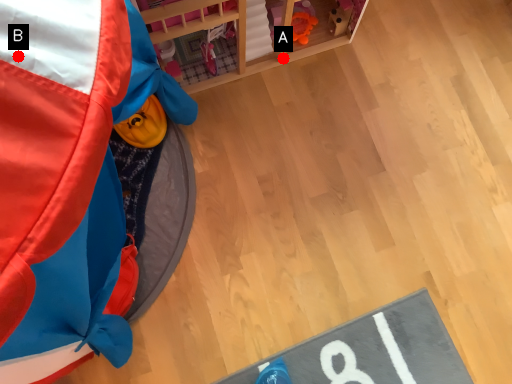
Question: Two points are circled on the image, labeled by A and B beside each circle. Which point is closer to the camera taking this photo?

Choices:
 (A) A is closer
 (B) B is closer

Answer: (B)